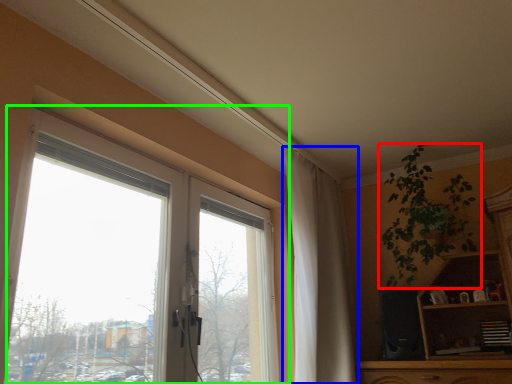
Question: Estimate the real-world distances between objects in this image. Which object is closer to houseplant (highlighted by a red box), curtain (highlighted by a blue box) or window (highlighted by a green box)?

Choices:
 (A) curtain
 (B) window

Answer: (A)